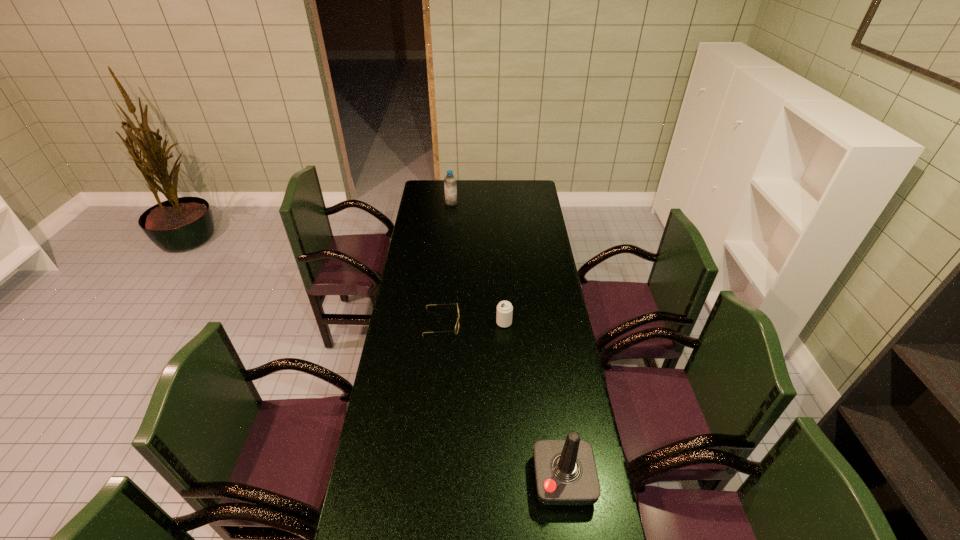
At what (x,y) coordinates should I click in order to perform the action: click on free space located 0.350m on the front-facing side of the shortest object. Please return your answer as a coordinate pair (x, y). Looking at the image, I should click on (542, 322).

This screenshot has height=540, width=960. Find the location of `object at the far edge`. object at the far edge is located at coordinates (450, 186).

Locate an element on the screen. Image resolution: width=960 pixels, height=540 pixels. object present at the left edge is located at coordinates (457, 324).

Locate an element on the screen. The height and width of the screenshot is (540, 960). object located in the right edge section of the desktop is located at coordinates (565, 470).

Where is `vacant position at the far edge of the desktop`? The height and width of the screenshot is (540, 960). vacant position at the far edge of the desktop is located at coordinates (512, 183).

In the image, there is a desktop. Identify the location of free space at the left edge. The height and width of the screenshot is (540, 960). point(403,397).

Identify the location of free region at the right edge of the desktop. The image size is (960, 540). (559, 388).

Find the location of a particular element. Image resolution: width=960 pixels, height=540 pixels. free spot at the far right corner of the desktop is located at coordinates (520, 190).

Where is `unoccupied area between the second shortest object and the rightmost object`? unoccupied area between the second shortest object and the rightmost object is located at coordinates (534, 401).

Find the location of `free point between the third shortest object and the rightmost object`. free point between the third shortest object and the rightmost object is located at coordinates (507, 341).